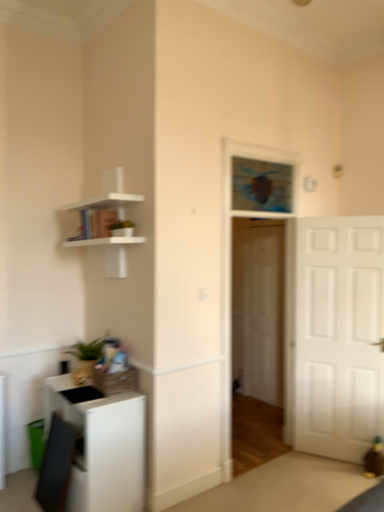
The height and width of the screenshot is (512, 384). In order to click on vacant point to the left of white matte door at right, which is the second door in back-to-front order in this screenshot , I will do `click(295, 473)`.